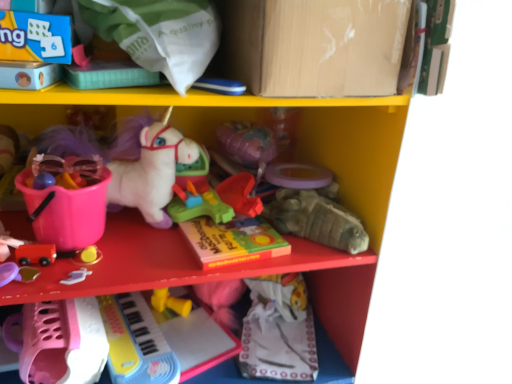
This screenshot has width=512, height=384. I want to click on empty space that is ontop of matte plastic book at center (from a real-world perspective), so (227, 227).